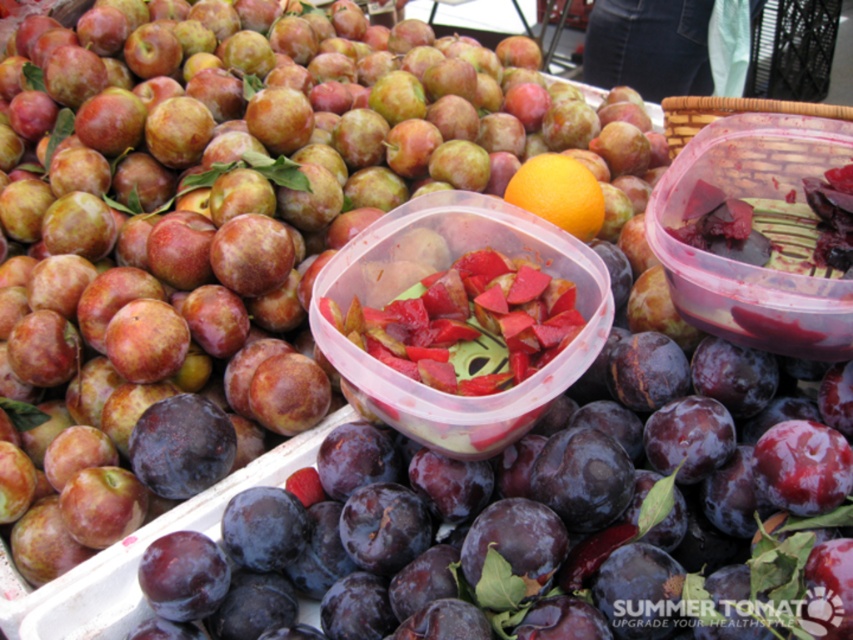
Can you confirm if shiny red apple at upper left is taller than orange matte at center?

Correct, shiny red apple at upper left is much taller as orange matte at center.

Does point (445, 120) come farther from viewer compared to point (596, 212)?

That is True.

Identify the location of shiny red apple at upper left. (216, 211).